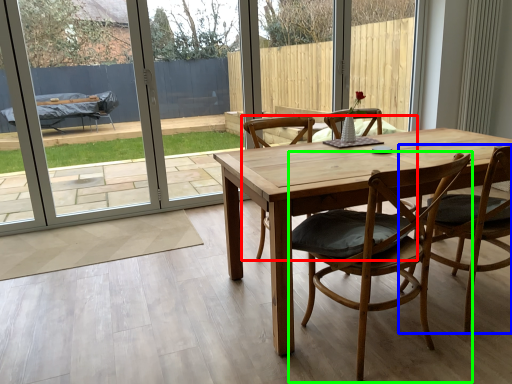
Question: Estimate the real-world distances between objects in this image. Which object is farther from chair (highlighted by a red box), chair (highlighted by a blue box) or chair (highlighted by a green box)?

Choices:
 (A) chair
 (B) chair

Answer: (B)